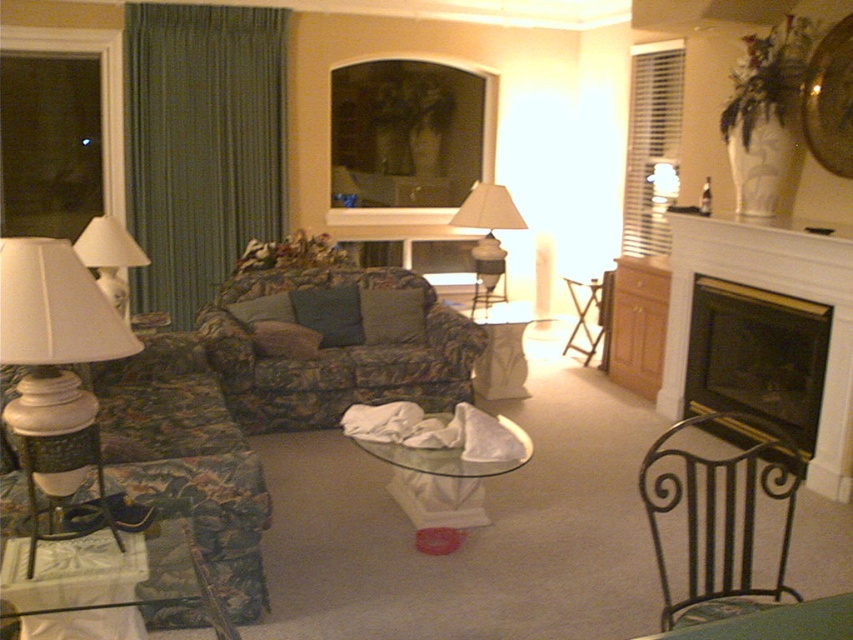
Which is above, floral fabric couch at left or iron/metallic armchair at lower right?

floral fabric couch at left is above.

Is floral fabric couch at left wider than iron/metallic armchair at lower right?

No, floral fabric couch at left is not wider than iron/metallic armchair at lower right.

Is point (154, 410) more distant than point (732, 484)?

Yes, it is.

Identify the location of floral fabric couch at left. (187, 460).

Does point (743, 621) come in front of point (80, 252)?

Yes, point (743, 621) is closer to viewer.

Which of these two, clear glass table at lower center or white glossy lampshade at left, stands taller?

With more height is white glossy lampshade at left.

Is point (839, 624) positioned behind point (102, 253)?

No, (839, 624) is closer to viewer.

The height and width of the screenshot is (640, 853). Find the location of `clear glass table at lower center`. clear glass table at lower center is located at coordinates (778, 621).

Consider the image. Does floral fabric couch at center have a greater height compared to floral fabric couch at left?

Yes.

How distant is floral fabric couch at center from floral fabric couch at left?

floral fabric couch at center and floral fabric couch at left are 32.36 inches apart.

Where is `floral fabric couch at center`? floral fabric couch at center is located at coordinates (337, 346).